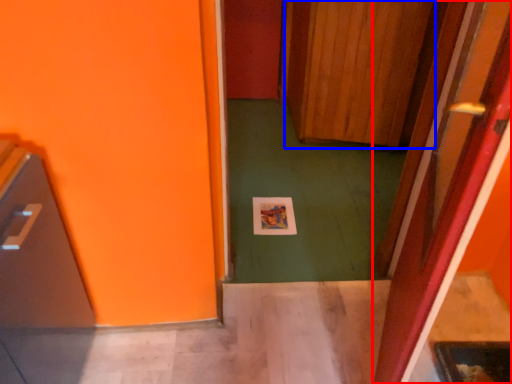
Question: Which point is further to the camera, door (highlighted by a red box) or door (highlighted by a blue box)?

Choices:
 (A) door
 (B) door

Answer: (B)